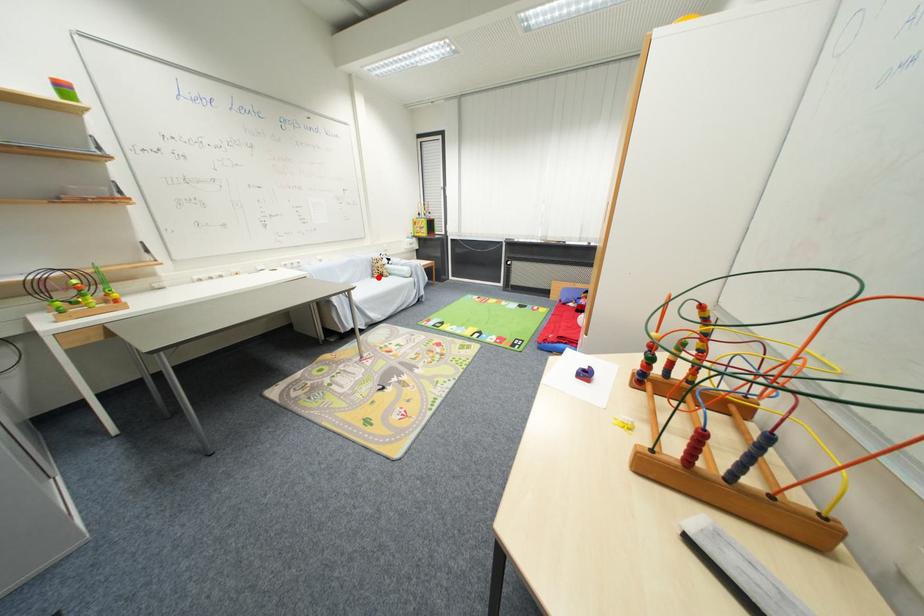
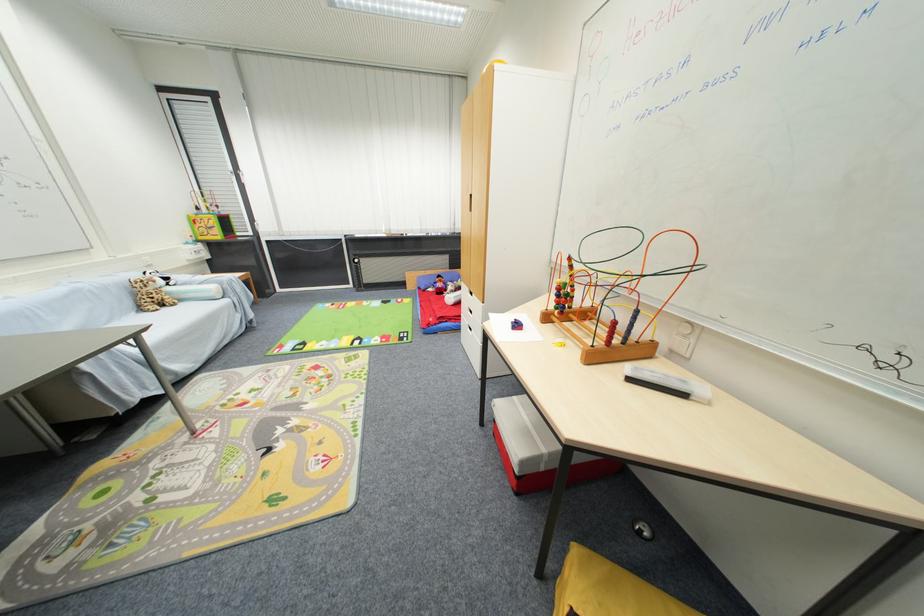
The point at the highlighted location is marked in the first image. Where is the corresponding point in the second image?

(146, 310)